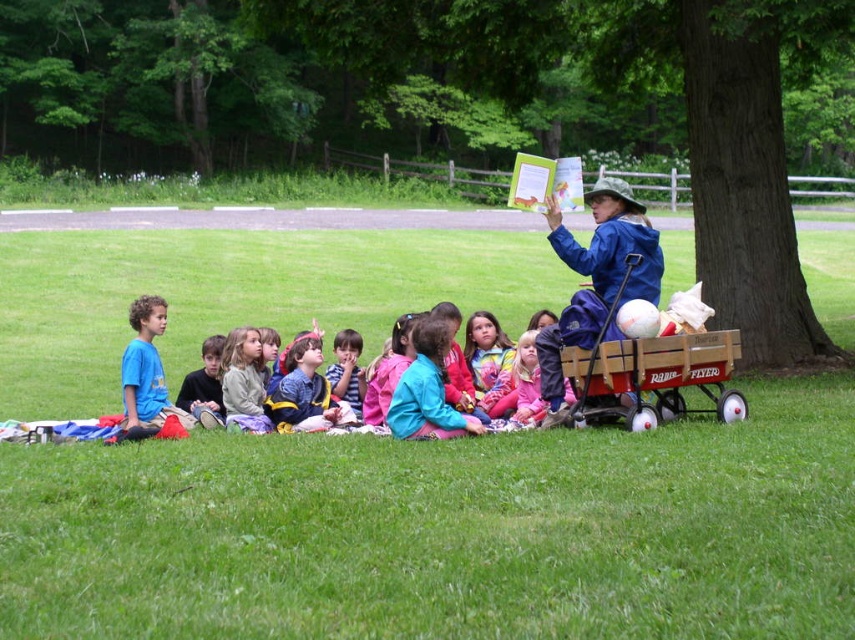
Is wooden wagon at right shorter than blue t-shirt at left?

No, wooden wagon at right is not shorter than blue t-shirt at left.

This screenshot has height=640, width=855. What are the coordinates of `wooden wagon at right` in the screenshot? It's located at (652, 372).

What are the coordinates of `wooden wagon at right` in the screenshot? It's located at (652, 372).

Does matte blue shirt at lower left have a greater width compared to matte blue shirt at center?

Yes.

Which is in front, point (205, 371) or point (340, 385)?

Point (340, 385) is more forward.

Find the location of a particular element. matte blue shirt at lower left is located at coordinates (204, 387).

Can you confirm if green rough bark tree at center right is positioned below matte blue shirt at center?

No, green rough bark tree at center right is not below matte blue shirt at center.

Between point (435, 19) and point (335, 397), which one is positioned in front?

Point (335, 397) is in front.

Locate an element on the screen. green rough bark tree at center right is located at coordinates (461, 93).